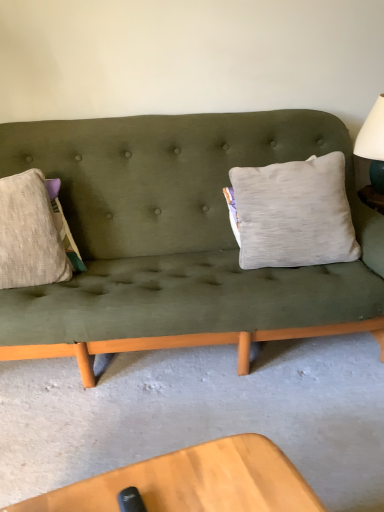
I want to click on gray fabric pillow at center-right, so click(292, 213).

What is the approximate height of gray fabric pillow at center-right?

The height of gray fabric pillow at center-right is 24.43 inches.

The image size is (384, 512). Describe the element at coordinates (292, 213) in the screenshot. I see `gray fabric pillow at center-right` at that location.

What is the approximate width of gray fabric pillow at center-right?

It is 11.01 inches.

What is the approximate width of white matte table lamp at upper right?

white matte table lamp at upper right is 14.09 inches wide.

What is the approximate height of white matte table lamp at upper right?

17.42 inches.

The width and height of the screenshot is (384, 512). Identify the location of white matte table lamp at upper right. (373, 155).

Measure the distance between point (378, 162) and camera.

Point (378, 162) and camera are 1.54 meters apart from each other.

Describe the element at coordinates (373, 155) in the screenshot. I see `white matte table lamp at upper right` at that location.

I want to click on gray fabric pillow at center-right, so click(292, 213).

Is gray fabric pillow at center-right to the right of white matte table lamp at upper right from the viewer's perspective?

No, gray fabric pillow at center-right is not to the right of white matte table lamp at upper right.

Between gray fabric pillow at center-right and white matte table lamp at upper right, which one is positioned in front?

gray fabric pillow at center-right is more forward.

Is point (293, 248) positioned in front of point (360, 157)?

Yes, it is in front of point (360, 157).

From the image's perspective, which is below, gray fabric pillow at center-right or white matte table lamp at upper right?

gray fabric pillow at center-right, from the image's perspective.

Based on the photo, from a real-world perspective, who is located higher, gray fabric pillow at center-right or white matte table lamp at upper right?

white matte table lamp at upper right, from a real-world perspective.

From the picture: Between gray fabric pillow at center-right and white matte table lamp at upper right, which one has larger width?

white matte table lamp at upper right is wider.

Between gray fabric pillow at center-right and white matte table lamp at upper right, which one has more height?

Standing taller between the two is gray fabric pillow at center-right.

Which of these two, gray fabric pillow at center-right or white matte table lamp at upper right, is bigger?

gray fabric pillow at center-right.

Is gray fabric pillow at center-right located outside white matte table lamp at upper right?

Yes, gray fabric pillow at center-right is outside of white matte table lamp at upper right.

Is gray fabric pillow at center-right far from white matte table lamp at upper right?

No, gray fabric pillow at center-right is not far away from white matte table lamp at upper right.

Is white matte table lamp at upper right at the back of gray fabric pillow at center-right?

No, gray fabric pillow at center-right's orientation is not away from white matte table lamp at upper right.

How different are the orientations of gray fabric pillow at center-right and white matte table lamp at upper right in degrees?

There is a 5.59-degree angle between the facing directions of gray fabric pillow at center-right and white matte table lamp at upper right.

Based on the photo, how much distance is there between gray fabric pillow at center-right and white matte table lamp at upper right?

A distance of 9.90 inches exists between gray fabric pillow at center-right and white matte table lamp at upper right.

Where is `table lamp located above the gray fabric pillow at center-right (from the image's perspective)`? This screenshot has height=512, width=384. table lamp located above the gray fabric pillow at center-right (from the image's perspective) is located at coordinates (373, 155).

Is white matte table lamp at upper right to the left or to the right of gray fabric pillow at center-right in the image?

white matte table lamp at upper right is to the right of gray fabric pillow at center-right.

Between white matte table lamp at upper right and gray fabric pillow at center-right, which one is positioned behind?

white matte table lamp at upper right is more distant.

Considering the points (374, 149) and (306, 244), which point is behind, point (374, 149) or point (306, 244)?

The point (374, 149) is farther.

From the image's perspective, is white matte table lamp at upper right located beneath gray fabric pillow at center-right?

Actually, white matte table lamp at upper right appears above gray fabric pillow at center-right in the image.

From a real-world perspective, is white matte table lamp at upper right physically located above or below gray fabric pillow at center-right?

white matte table lamp at upper right is situated higher than gray fabric pillow at center-right in the real world.

Considering the relative sizes of white matte table lamp at upper right and gray fabric pillow at center-right in the image provided, is white matte table lamp at upper right wider than gray fabric pillow at center-right?

Yes, white matte table lamp at upper right is wider than gray fabric pillow at center-right.

Can you confirm if white matte table lamp at upper right is shorter than gray fabric pillow at center-right?

Yes.

Between white matte table lamp at upper right and gray fabric pillow at center-right, which one has smaller size?

white matte table lamp at upper right is smaller.

Is gray fabric pillow at center-right inside white matte table lamp at upper right?

No, gray fabric pillow at center-right is located outside of white matte table lamp at upper right.

In the scene shown: Is white matte table lamp at upper right with gray fabric pillow at center-right?

No.

Is white matte table lamp at upper right oriented away from gray fabric pillow at center-right?

No, white matte table lamp at upper right is not facing the opposite direction of gray fabric pillow at center-right.

How many degrees apart are the facing directions of white matte table lamp at upper right and gray fabric pillow at center-right?

The angle between the facing direction of white matte table lamp at upper right and the facing direction of gray fabric pillow at center-right is 5.59 degrees.

You are a GUI agent. You are given a task and a screenshot of the screen. Output one action in this format:
    pyautogui.click(x=<x>, y=<y>)
    Task: Click on the pillow located underneath the white matte table lamp at upper right (from a real-world perspective)
    This screenshot has width=384, height=512.
    Given the screenshot: What is the action you would take?
    pyautogui.click(x=292, y=213)

Find the location of a particular element. This screenshot has width=384, height=512. table lamp above the gray fabric pillow at center-right (from the image's perspective) is located at coordinates (373, 155).

Image resolution: width=384 pixels, height=512 pixels. I want to click on pillow below the white matte table lamp at upper right (from a real-world perspective), so click(x=292, y=213).